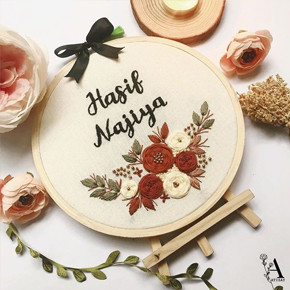
Locate an element on the screen. The image size is (290, 290). cross stitch art is located at coordinates (143, 133).